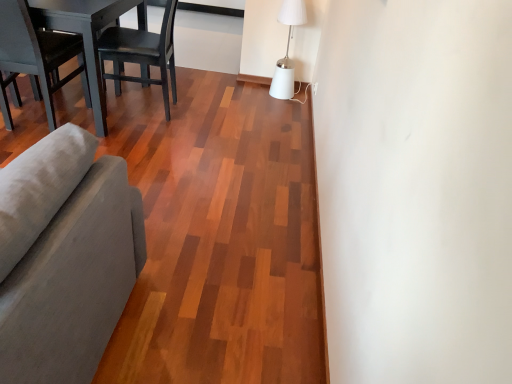
Question: Does matte gray chair at left, which ranks as the 2th chair in right-to-left order, have a greater width compared to white matte table lamp at upper right?

Choices:
 (A) yes
 (B) no

Answer: (A)

Question: Is matte gray chair at left, which ranks as the 2th chair in right-to-left order, oriented away from white matte table lamp at upper right?

Choices:
 (A) no
 (B) yes

Answer: (A)

Question: From a real-world perspective, is matte gray chair at left, which ranks as the 2th chair in right-to-left order, physically below white matte table lamp at upper right?

Choices:
 (A) no
 (B) yes

Answer: (A)

Question: Is matte gray chair at left, which ranks as the 2th chair in right-to-left order, to the left of white matte table lamp at upper right from the viewer's perspective?

Choices:
 (A) yes
 (B) no

Answer: (A)

Question: From a real-world perspective, is matte gray chair at left, which ranks as the 2th chair in right-to-left order, located higher than white matte table lamp at upper right?

Choices:
 (A) yes
 (B) no

Answer: (A)

Question: Looking at the image, does matte gray chair at left, the first chair viewed from the left, seem bigger or smaller compared to black matte wood chair at upper left, the second chair in the left-to-right sequence?

Choices:
 (A) small
 (B) big

Answer: (A)

Question: Does point (87, 89) appear closer or farther from the camera than point (144, 77)?

Choices:
 (A) closer
 (B) farther

Answer: (A)

Question: From a real-world perspective, is matte gray chair at left, which ranks as the 2th chair in right-to-left order, positioned above or below black matte wood chair at upper left, positioned as the first chair in right-to-left order?

Choices:
 (A) below
 (B) above

Answer: (B)

Question: Is matte gray chair at left, which ranks as the 2th chair in right-to-left order, in front of or behind black matte wood chair at upper left, positioned as the first chair in right-to-left order, in the image?

Choices:
 (A) behind
 (B) front

Answer: (B)

Question: Is gray fabric couch at left in front of or behind dark wood table at left in the image?

Choices:
 (A) front
 (B) behind

Answer: (A)

Question: From the image's perspective, is gray fabric couch at left positioned above or below dark wood table at left?

Choices:
 (A) above
 (B) below

Answer: (B)

Question: Which is correct: gray fabric couch at left is inside dark wood table at left, or outside of it?

Choices:
 (A) outside
 (B) inside

Answer: (A)

Question: From a real-world perspective, is gray fabric couch at left physically located above or below dark wood table at left?

Choices:
 (A) below
 (B) above

Answer: (B)

Question: Considering their positions, is gray fabric couch at left located in front of or behind white matte table lamp at upper right?

Choices:
 (A) front
 (B) behind

Answer: (A)

Question: Would you say gray fabric couch at left is inside or outside white matte table lamp at upper right?

Choices:
 (A) inside
 (B) outside

Answer: (B)